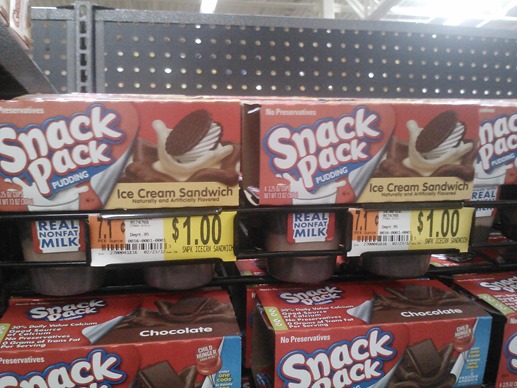
The height and width of the screenshot is (388, 517). I want to click on middle shelf, so 330,335.